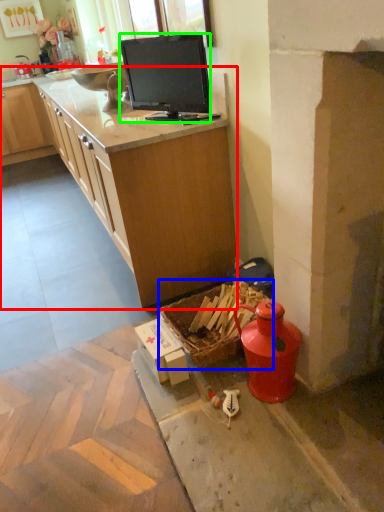
Question: Considering the real-world distances, which object is farthest from countertop (highlighted by a red box)? picnic basket (highlighted by a blue box) or television (highlighted by a green box)?

Choices:
 (A) picnic basket
 (B) television

Answer: (A)